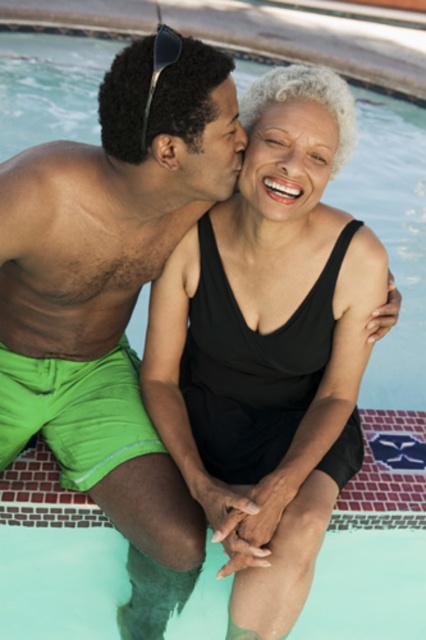
Looking at this image, who is higher up, green matte shorts at left or black matte swimsuit at center?

Positioned higher is black matte swimsuit at center.

Is the position of green matte shorts at left more distant than that of black matte swimsuit at center?

That is False.

Locate an element on the screen. green matte shorts at left is located at coordinates (111, 288).

What are the coordinates of `green matte shorts at left` in the screenshot? It's located at (111, 288).

Is green matte shorts at left positioned in front of matte black sunglasses at upper left?

No, it is behind matte black sunglasses at upper left.

Who is positioned more to the right, green matte shorts at left or matte black sunglasses at upper left?

From the viewer's perspective, matte black sunglasses at upper left appears more on the right side.

Image resolution: width=426 pixels, height=640 pixels. Describe the element at coordinates (111, 288) in the screenshot. I see `green matte shorts at left` at that location.

Find the location of a particular element. This screenshot has width=426, height=640. green matte shorts at left is located at coordinates tap(111, 288).

Measure the distance from black matte swimsuit at center to matte black sunglasses at upper left.

The distance of black matte swimsuit at center from matte black sunglasses at upper left is 36.12 inches.

Is black matte swimsuit at center thinner than matte black sunglasses at upper left?

No.

Between point (163, 348) and point (169, 29), which one is positioned behind?

The point (163, 348) is behind.

This screenshot has height=640, width=426. Find the location of `black matte swimsuit at center`. black matte swimsuit at center is located at coordinates (267, 336).